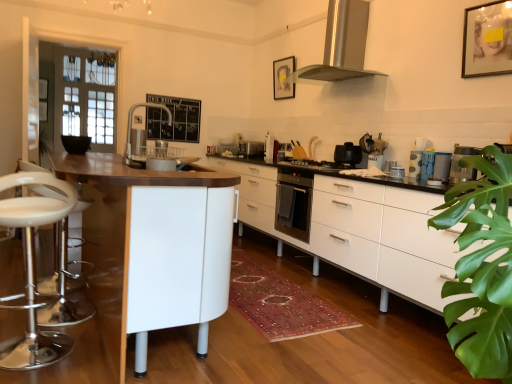
Question: Considering the relative positions of matte plastic cups at right, the 1th appliance positioned from the right, and black matte gas stove at center in the image provided, is matte plastic cups at right, the 1th appliance positioned from the right, to the left of black matte gas stove at center from the viewer's perspective?

Choices:
 (A) no
 (B) yes

Answer: (A)

Question: Are matte plastic cups at right, positioned as the 3th appliance in top-to-bottom order, and black matte gas stove at center far apart?

Choices:
 (A) yes
 (B) no

Answer: (B)

Question: Could you tell me if matte plastic cups at right, which is the fourth appliance in left-to-right order, is facing black matte gas stove at center?

Choices:
 (A) no
 (B) yes

Answer: (A)

Question: Can you confirm if matte plastic cups at right, which is counted as the fourth appliance, starting from the back, is thinner than black matte gas stove at center?

Choices:
 (A) no
 (B) yes

Answer: (B)

Question: Is matte plastic cups at right, which is counted as the fourth appliance, starting from the back, to the right of black matte gas stove at center from the viewer's perspective?

Choices:
 (A) yes
 (B) no

Answer: (A)

Question: Does matte plastic cups at right, which is counted as the fourth appliance, starting from the back, have a larger size compared to black matte gas stove at center?

Choices:
 (A) yes
 (B) no

Answer: (B)

Question: Is white glossy coffee maker at center, which is the second appliance from top to bottom, facing away from stainless steel range hood at upper center?

Choices:
 (A) yes
 (B) no

Answer: (B)

Question: From the image's perspective, is white glossy coffee maker at center, which ranks as the 2th appliance in right-to-left order, below stainless steel range hood at upper center?

Choices:
 (A) yes
 (B) no

Answer: (A)

Question: From a real-world perspective, is white glossy coffee maker at center, positioned as the 2th appliance in back-to-front order, under stainless steel range hood at upper center?

Choices:
 (A) yes
 (B) no

Answer: (A)

Question: Does white glossy coffee maker at center, which is the second appliance from top to bottom, appear on the right side of stainless steel range hood at upper center?

Choices:
 (A) yes
 (B) no

Answer: (A)

Question: Can you confirm if white glossy coffee maker at center, which ranks as the 2th appliance in right-to-left order, is bigger than stainless steel range hood at upper center?

Choices:
 (A) no
 (B) yes

Answer: (A)

Question: Is white glossy coffee maker at center, which is the second appliance from top to bottom, not close to stainless steel range hood at upper center?

Choices:
 (A) yes
 (B) no

Answer: (A)

Question: From the image's perspective, is white glossy coffee maker at center, positioned as the 3th appliance in back-to-front order, below white glossy coffee maker at center, which appears as the 3th appliance when viewed from the front?

Choices:
 (A) yes
 (B) no

Answer: (A)